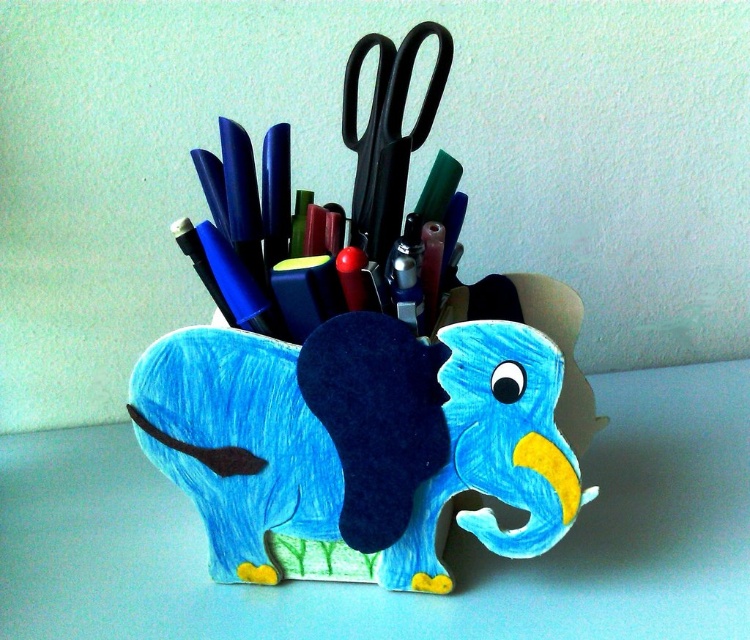
Is blue felt elephant at center below black plastic scissors at center?

Indeed, blue felt elephant at center is positioned under black plastic scissors at center.

Can you confirm if blue felt elephant at center is positioned above black plastic scissors at center?

Actually, blue felt elephant at center is below black plastic scissors at center.

Which is in front, point (417, 400) or point (376, 36)?

Positioned in front is point (417, 400).

Identify the location of blue felt elephant at center. (358, 444).